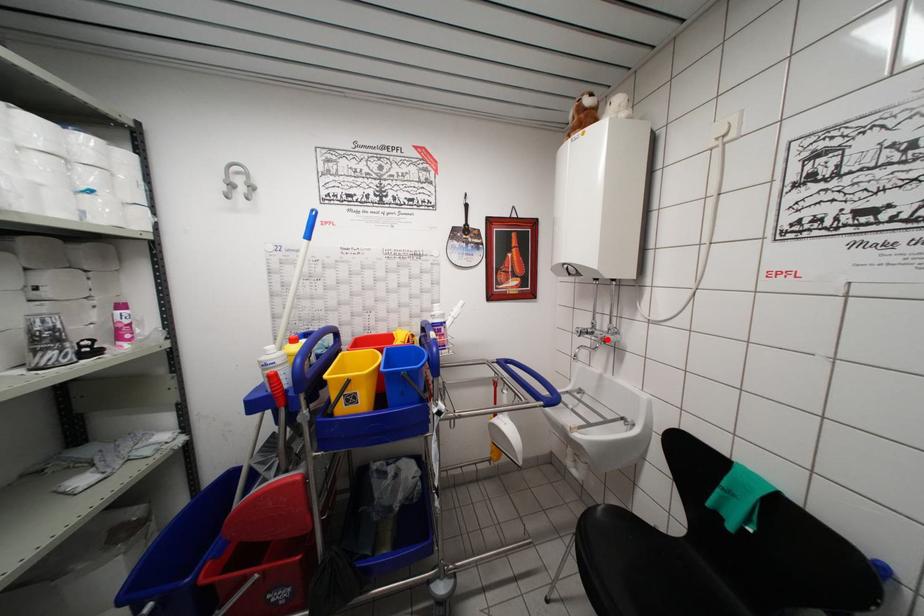
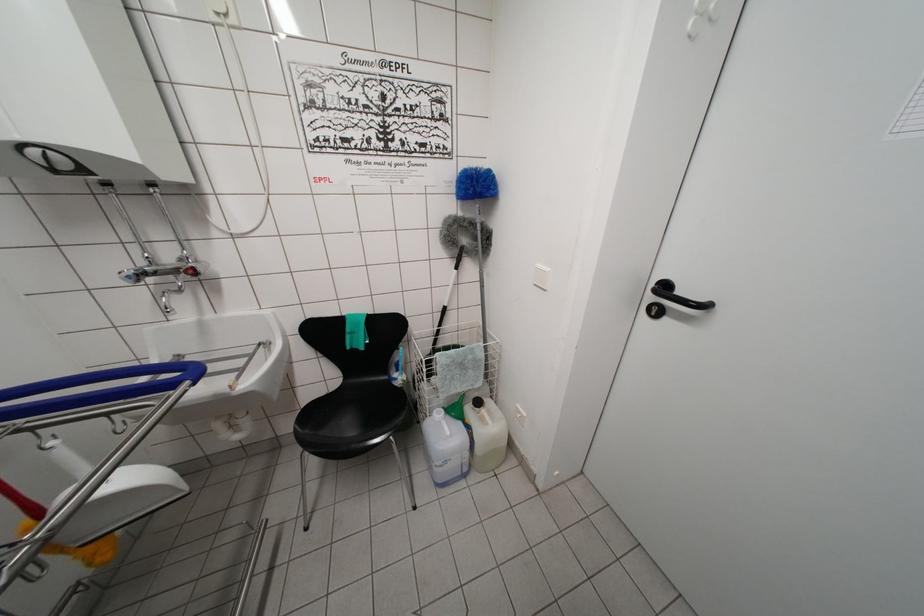
The point at the highlighted location is marked in the first image. Where is the corresponding point in the second image?

(193, 270)